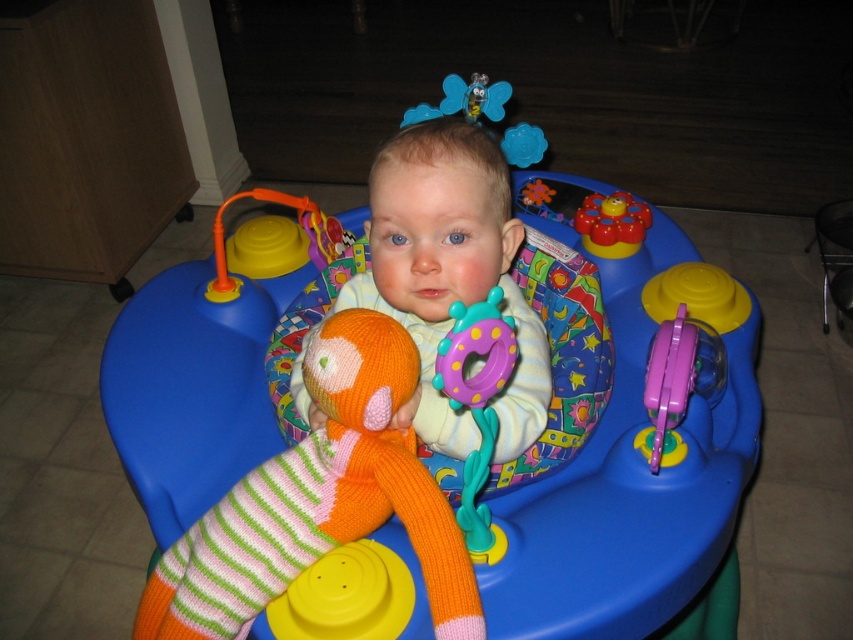
Which of these two, orange knitted sock at center or rubberized purple phone at center right, stands shorter?

rubberized purple phone at center right is shorter.

Measure the distance between point (384,468) and camera.

A distance of 31.57 inches exists between point (384,468) and camera.

Identify the location of orange knitted sock at center. (318, 500).

Is rubberized purple phone at center right bigger than rubberized yellow flower at center?

Correct, rubberized purple phone at center right is larger in size than rubberized yellow flower at center.

Is point (653, 408) closer to camera compared to point (607, 256)?

Yes, it is.

Find the location of a particular element. The width and height of the screenshot is (853, 640). rubberized purple phone at center right is located at coordinates (680, 374).

How distant is purple rubber teething ring at center from rubberized yellow flower at center?

purple rubber teething ring at center is 29.09 inches away from rubberized yellow flower at center.

Describe the element at coordinates (477, 404) in the screenshot. The width and height of the screenshot is (853, 640). I see `purple rubber teething ring at center` at that location.

Is point (479, 547) behind point (616, 232)?

That is False.

Where is `purple rubber teething ring at center`? purple rubber teething ring at center is located at coordinates click(477, 404).